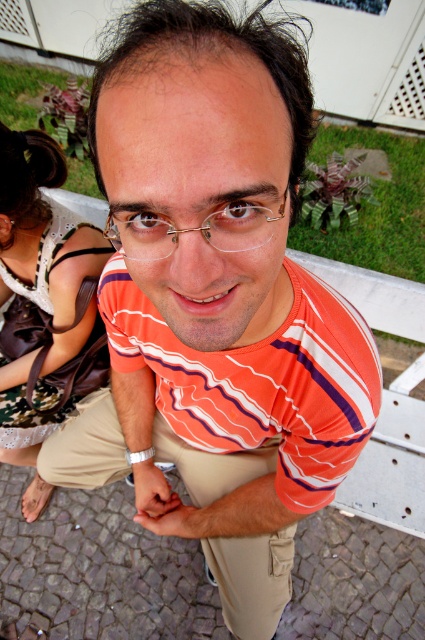
You are a photographer trying to capture the gold metallic glasses at center and the brown leather purse at left in the same frame. Based on their positions, will the purse be visible in the photo if you focus on the glasses?

The brown leather purse at left is positioned under gold metallic glasses at center, so if you focus on the glasses, the purse will still be visible in the photo as it is located below them.

You are a photographer setting up a shot of the man in the scene. You need to position a small tripod between the brown leather purse at left and the khaki pants at center. Based on their thickness, which object should the tripod be closer to?

The brown leather purse at left is thinner than the khaki pants at center, so the tripod should be placed closer to the brown leather purse at left to ensure proper spacing between the two objects.

You are a photographer setting up a shot of the man in the scene. You need to place a small prop between the brown leather purse at left and the khaki pants at center. What is the minimum distance the prop needs to be placed from each object to fit exactly between them?

The minimum distance the prop needs to be placed from each object is 7.225 inches, as the total distance between the brown leather purse at left and the khaki pants at center is 14.45 inches. Dividing this distance by two gives 7.225 inches for each side.